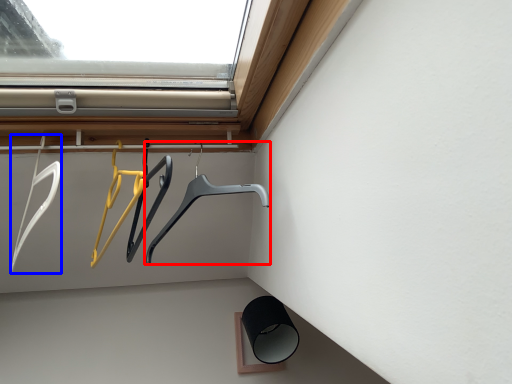
Question: Which object appears farthest to the camera in this image, hanger (highlighted by a red box) or hanger (highlighted by a blue box)?

Choices:
 (A) hanger
 (B) hanger

Answer: (A)